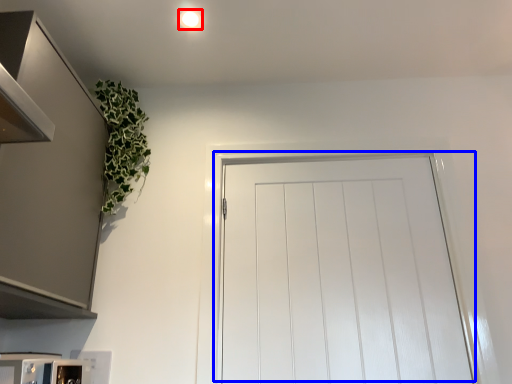
Question: Among these objects, which one is farthest to the camera, lighting (highlighted by a red box) or door (highlighted by a blue box)?

Choices:
 (A) lighting
 (B) door

Answer: (A)